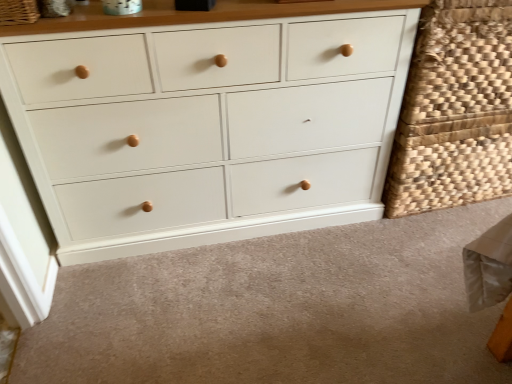
I want to click on vacant area on top of white matte drawer at lower center (from a real-world perspective), so click(314, 289).